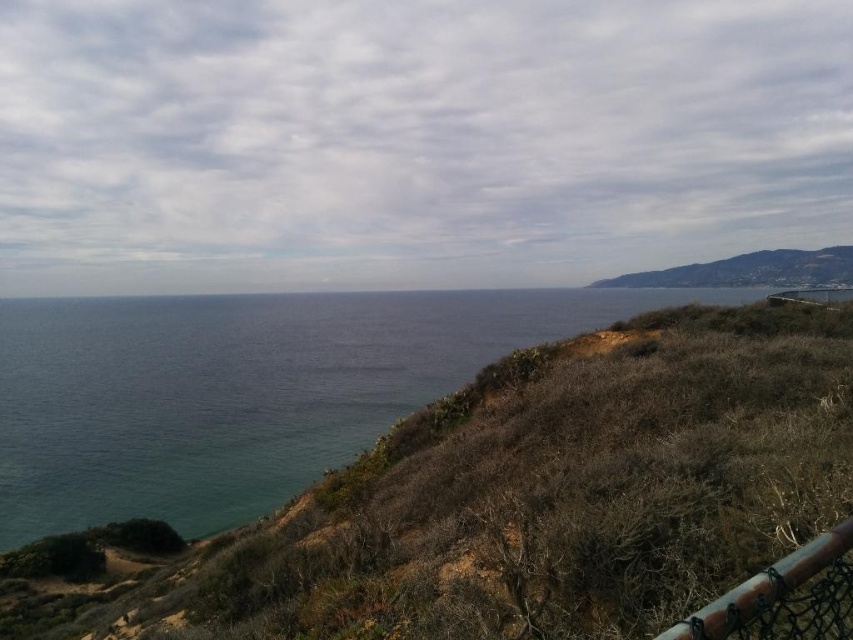
You are standing at the edge of the rugged, dry hillside and want to walk towards the ocean. Which object, the brown mesh fence at lower right or the brown grassy hillside at upper right, is closer to you as you start your journey?

The brown mesh fence at lower right is closer to the viewer than the brown grassy hillside at upper right, so the brown mesh fence at lower right is closer to you as you start your journey.

You are standing at the edge of the rugged hillside in the coastal landscape and see two points marked in the image. Which point, point (26, 413) or point (805, 573), is closer to you?

Point (26, 413) is closer to you because it is further to the viewer than point (805, 573).